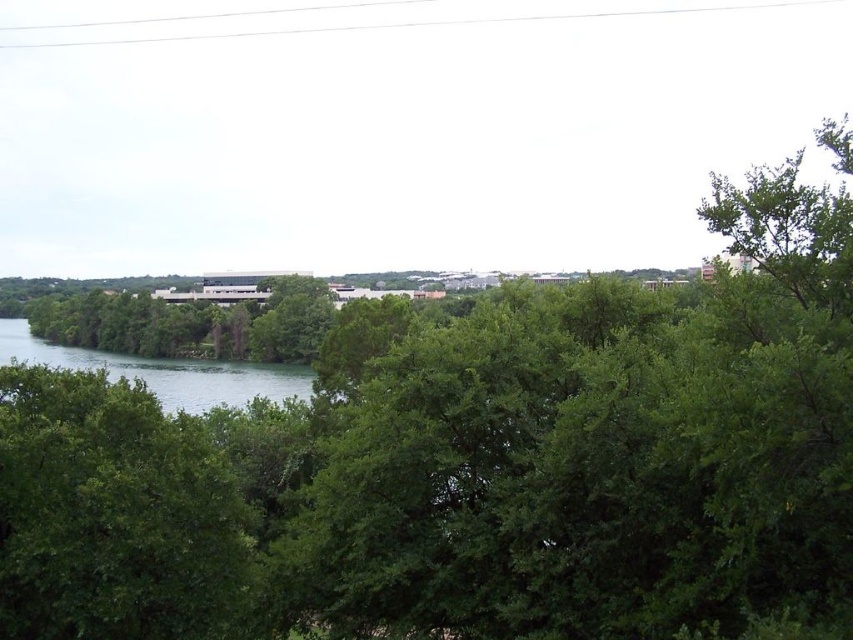
You are a bird flying over the serene landscape. You see the green leafy tree at left and the green water at lower left. Which object is located above the other?

The green leafy tree at left is positioned over green water at lower left, so the tree is above the water.

You are a hiker who wants to cross the green water at lower left using the green leafy tree at left as a bridge. Can you reach the other side if the tree is long enough to span the distance?

The green leafy tree at left is 25.76 meters from the green water at lower left. Since the tree is long enough to span the distance, you can use it as a bridge to reach the other side.